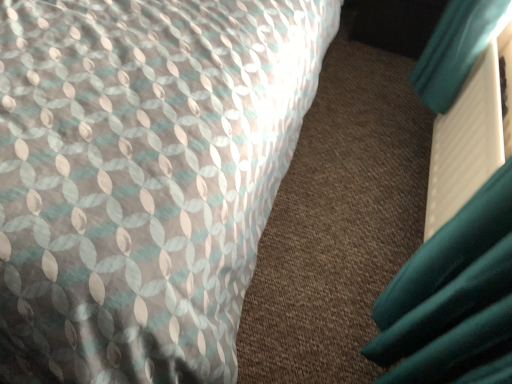
Question: Is textured fabric bed at upper left facing towards teal matte book at right?

Choices:
 (A) yes
 (B) no

Answer: (B)

Question: Is textured fabric bed at upper left at the right side of teal matte book at right?

Choices:
 (A) yes
 (B) no

Answer: (B)

Question: From the image's perspective, is textured fabric bed at upper left over teal matte book at right?

Choices:
 (A) yes
 (B) no

Answer: (A)

Question: Is textured fabric bed at upper left facing away from teal matte book at right?

Choices:
 (A) yes
 (B) no

Answer: (B)

Question: From the image's perspective, would you say textured fabric bed at upper left is shown under teal matte book at right?

Choices:
 (A) yes
 (B) no

Answer: (B)

Question: Does textured fabric bed at upper left have a larger size compared to teal matte book at right?

Choices:
 (A) yes
 (B) no

Answer: (A)

Question: From the image's perspective, is teal matte book at right above textured fabric bed at upper left?

Choices:
 (A) no
 (B) yes

Answer: (A)

Question: Is there a large distance between teal matte book at right and textured fabric bed at upper left?

Choices:
 (A) yes
 (B) no

Answer: (B)

Question: Can you confirm if teal matte book at right is shorter than textured fabric bed at upper left?

Choices:
 (A) no
 (B) yes

Answer: (B)

Question: Does teal matte book at right have a smaller size compared to textured fabric bed at upper left?

Choices:
 (A) no
 (B) yes

Answer: (B)

Question: From the image's perspective, is teal matte book at right below textured fabric bed at upper left?

Choices:
 (A) yes
 (B) no

Answer: (A)

Question: Does teal matte book at right turn towards textured fabric bed at upper left?

Choices:
 (A) no
 (B) yes

Answer: (B)

Question: Does point (129, 173) appear closer or farther from the camera than point (470, 119)?

Choices:
 (A) farther
 (B) closer

Answer: (B)